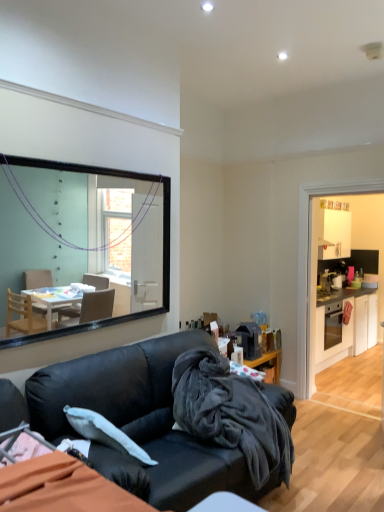
You are a GUI agent. You are given a task and a screenshot of the screen. Output one action in this format:
    pyautogui.click(x=<x>, y=<y>)
    Task: Click on the blank space situated above white glossy dresser at right (from a real-world perspective)
    The height and width of the screenshot is (512, 384).
    Given the screenshot: What is the action you would take?
    pyautogui.click(x=346, y=176)